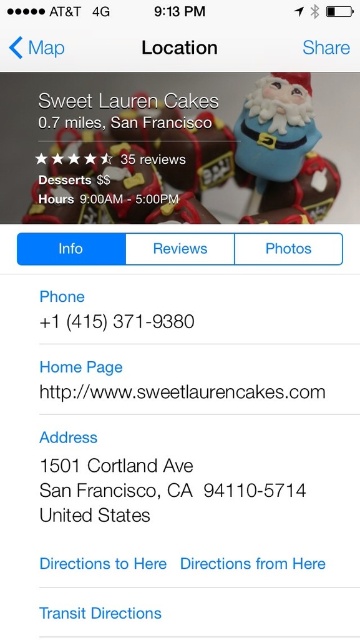
Who is positioned more to the left, matte blue figurine at upper right or white paper address at center?

white paper address at center is more to the left.

Does matte blue figurine at upper right have a larger size compared to white paper address at center?

Correct, matte blue figurine at upper right is larger in size than white paper address at center.

Where is `matte blue figurine at upper right`? matte blue figurine at upper right is located at coordinates (282, 150).

At what (x,y) coordinates should I click in order to perform the action: click on matte blue figurine at upper right. Please return your answer as a coordinate pair (x, y). The width and height of the screenshot is (360, 640). Looking at the image, I should click on (282, 150).